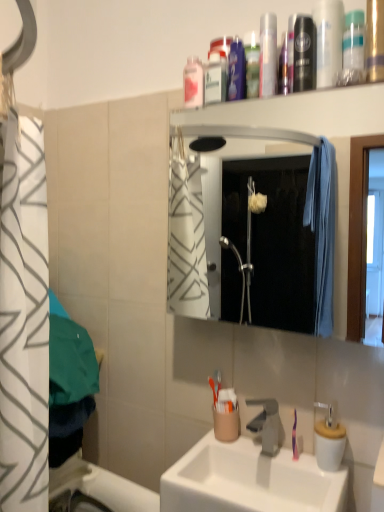
Question: Does satin nickel faucet at sink center appear on the left side of pink plastic toothbrush at lower right?

Choices:
 (A) no
 (B) yes

Answer: (B)

Question: From the image's perspective, is satin nickel faucet at sink center beneath pink plastic toothbrush at lower right?

Choices:
 (A) no
 (B) yes

Answer: (B)

Question: Is satin nickel faucet at sink center turned away from pink plastic toothbrush at lower right?

Choices:
 (A) no
 (B) yes

Answer: (A)

Question: From a real-world perspective, is satin nickel faucet at sink center beneath pink plastic toothbrush at lower right?

Choices:
 (A) no
 (B) yes

Answer: (B)

Question: Considering the relative sizes of satin nickel faucet at sink center and pink plastic toothbrush at lower right in the image provided, is satin nickel faucet at sink center taller than pink plastic toothbrush at lower right?

Choices:
 (A) yes
 (B) no

Answer: (B)

Question: Is satin nickel faucet at sink center outside pink plastic toothbrush at lower right?

Choices:
 (A) no
 (B) yes

Answer: (B)

Question: Does pink plastic mouthwash at upper center, arranged as the fourth mouthwash when viewed from the front, come in front of translucent plastic mouthwash at upper center, arranged as the second mouthwash when viewed from the back?

Choices:
 (A) no
 (B) yes

Answer: (A)

Question: Is pink plastic mouthwash at upper center, which is counted as the fourth mouthwash, starting from the right, not near translucent plastic mouthwash at upper center, placed as the 3th mouthwash when sorted from front to back?

Choices:
 (A) yes
 (B) no

Answer: (B)

Question: Considering the relative sizes of pink plastic mouthwash at upper center, marked as the 1th mouthwash in a back-to-front arrangement, and translucent plastic mouthwash at upper center, which is the 2th mouthwash from left to right, in the image provided, is pink plastic mouthwash at upper center, marked as the 1th mouthwash in a back-to-front arrangement, wider than translucent plastic mouthwash at upper center, which is the 2th mouthwash from left to right,?

Choices:
 (A) yes
 (B) no

Answer: (A)

Question: Can you confirm if pink plastic mouthwash at upper center, marked as the 1th mouthwash in a back-to-front arrangement, is thinner than translucent plastic mouthwash at upper center, placed as the 3th mouthwash when sorted from front to back?

Choices:
 (A) yes
 (B) no

Answer: (B)

Question: Is the position of pink plastic mouthwash at upper center, arranged as the fourth mouthwash when viewed from the front, more distant than that of translucent plastic mouthwash at upper center, placed as the 3th mouthwash when sorted from front to back?

Choices:
 (A) no
 (B) yes

Answer: (B)

Question: Is pink plastic mouthwash at upper center, which is counted as the fourth mouthwash, starting from the right, next to translucent plastic mouthwash at upper center, placed as the 3th mouthwash when sorted from front to back?

Choices:
 (A) no
 (B) yes

Answer: (A)

Question: Is white ceramic sink at center positioned beyond the bounds of metallic silver mouthwash at upper center, which appears as the 1th mouthwash when viewed from the front?

Choices:
 (A) no
 (B) yes

Answer: (B)